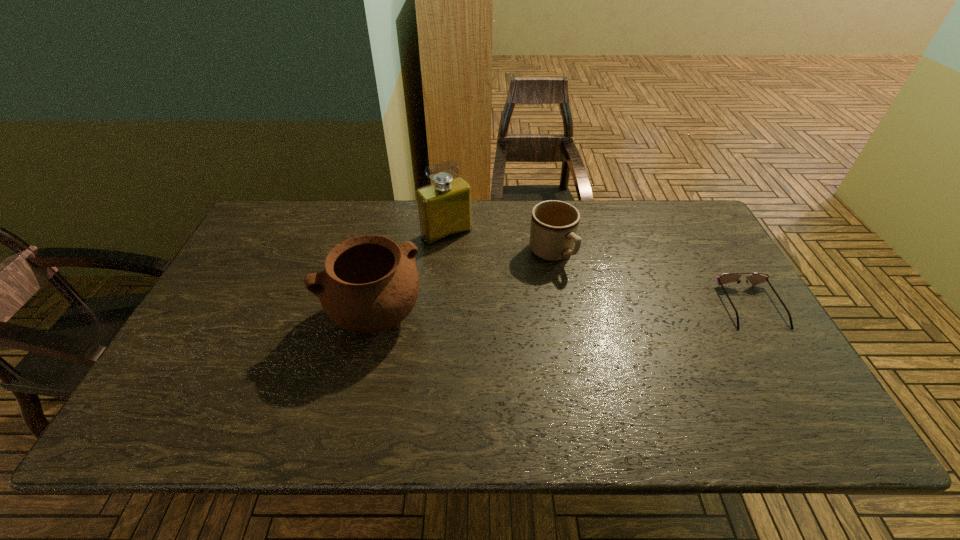
Image resolution: width=960 pixels, height=540 pixels. In order to click on vacant spot on the desktop that is between the pottery and the sunglasses and is positioned on the front-facing side of the perfume in this screenshot , I will do `click(513, 313)`.

The width and height of the screenshot is (960, 540). Find the location of `free space on the desktop that is between the second tallest object and the shortest object and is positioned on the side of the mug with the handle`. free space on the desktop that is between the second tallest object and the shortest object and is positioned on the side of the mug with the handle is located at coordinates [x=610, y=309].